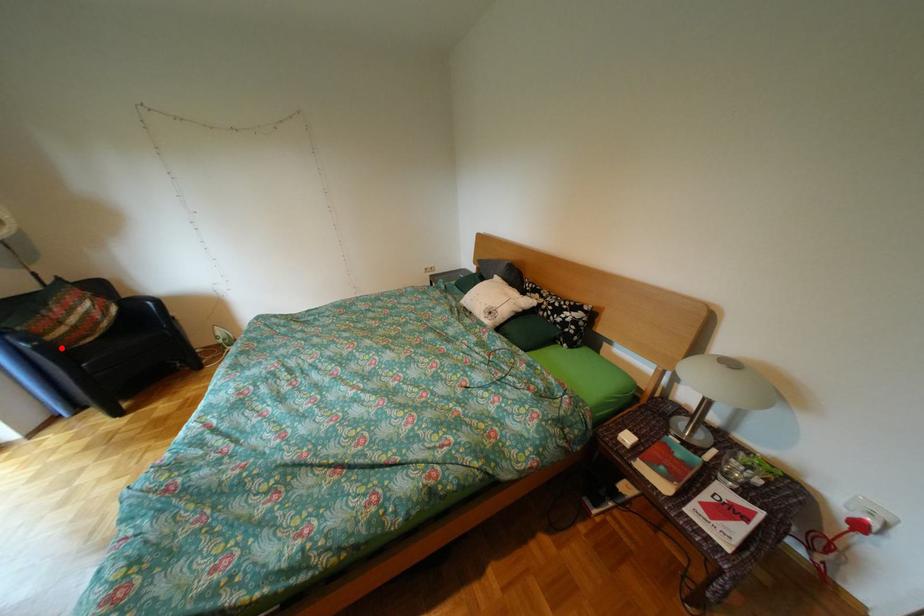
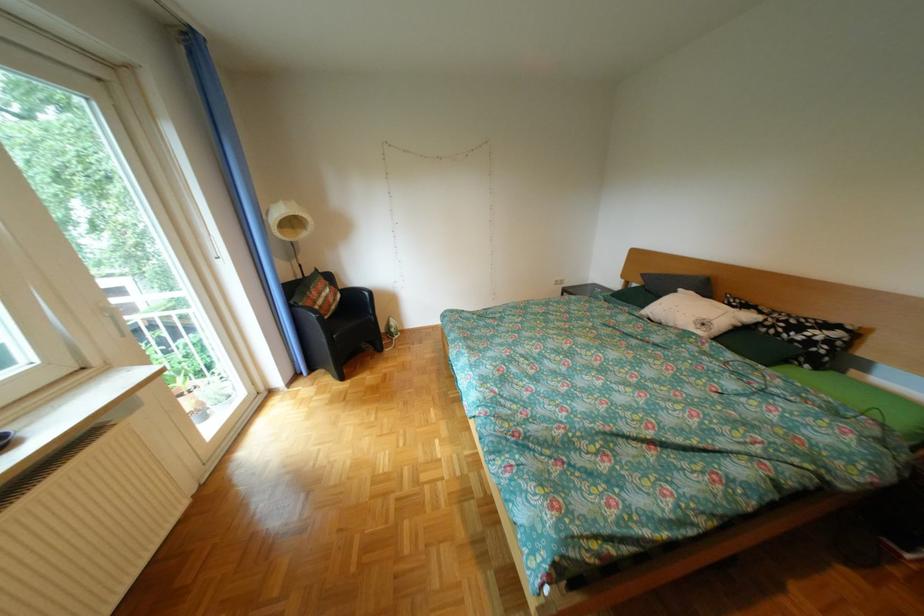
Question: I am providing you with two images of the same scene from different viewpoints. A red point is shown in image1. For the corresponding object point in image2, is it positioned nearer or farther from the camera?

Choices:
 (A) Nearer
 (B) Farther

Answer: (A)